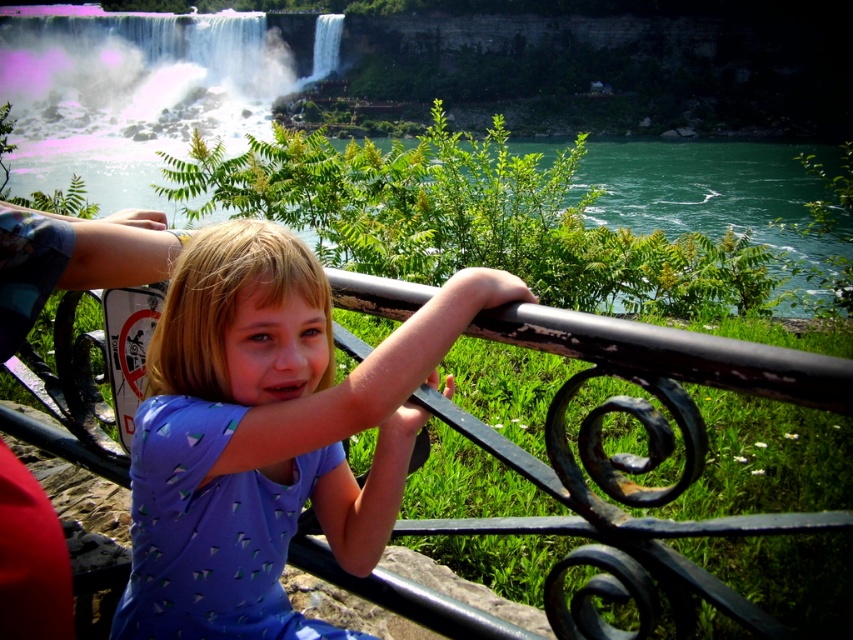
Question: Is green water at upper center bigger than white frothy water at upper left?

Choices:
 (A) yes
 (B) no

Answer: (B)

Question: Which is nearer to the white frothy water at upper left?

Choices:
 (A) green water at upper center
 (B) purple matte shirt at center

Answer: (A)

Question: Does purple matte shirt at center appear on the left side of green water at upper center?

Choices:
 (A) no
 (B) yes

Answer: (A)

Question: Which of the following is the closest to the observer?

Choices:
 (A) (239, 371)
 (B) (219, 64)
 (C) (322, 168)

Answer: (A)

Question: Based on their relative distances, which object is farther from the purple matte shirt at center?

Choices:
 (A) white frothy water at upper left
 (B) green water at upper center

Answer: (A)

Question: Is purple matte shirt at center positioned in front of white frothy water at upper left?

Choices:
 (A) yes
 (B) no

Answer: (A)